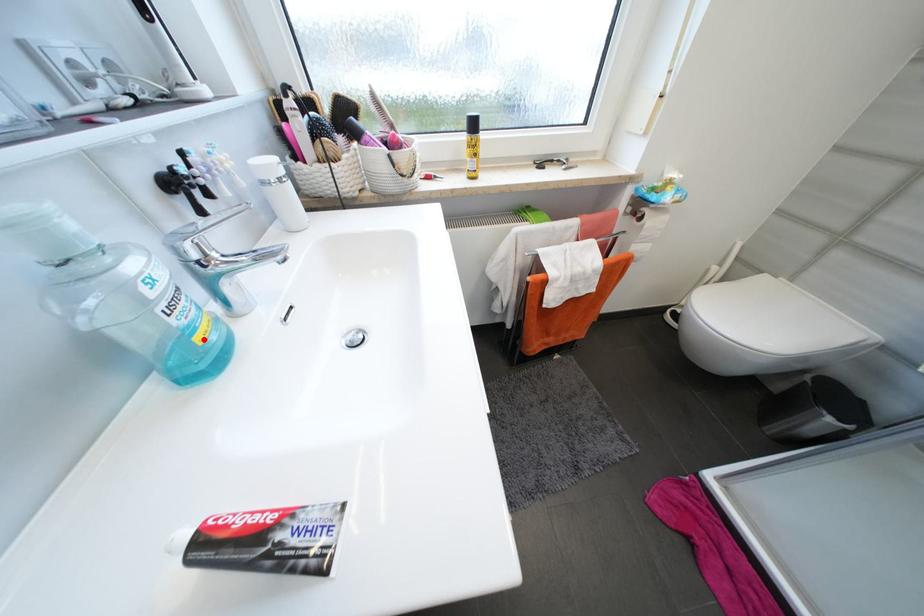
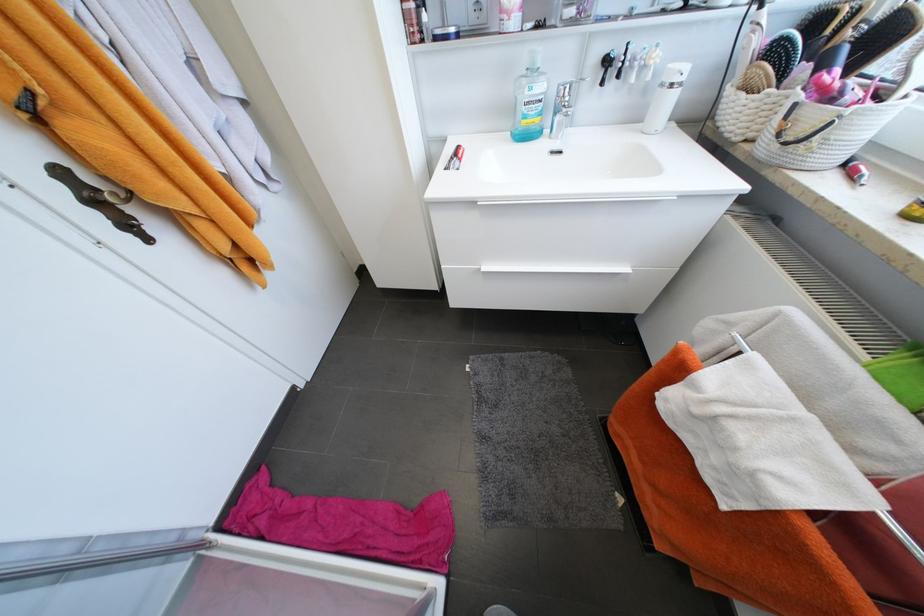
Where in the second image is the point corresponding to the highlighted location from the first image?

(529, 123)